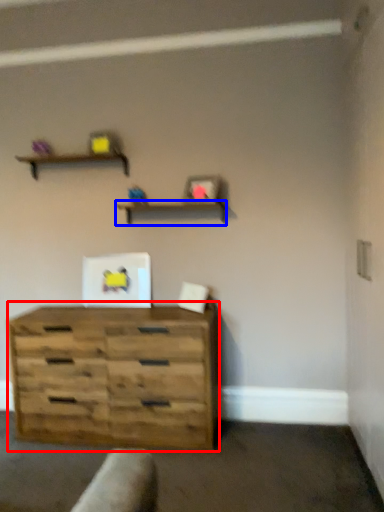
Question: Which object is further to the camera taking this photo, chest of drawers (highlighted by a red box) or shelf (highlighted by a blue box)?

Choices:
 (A) chest of drawers
 (B) shelf

Answer: (B)